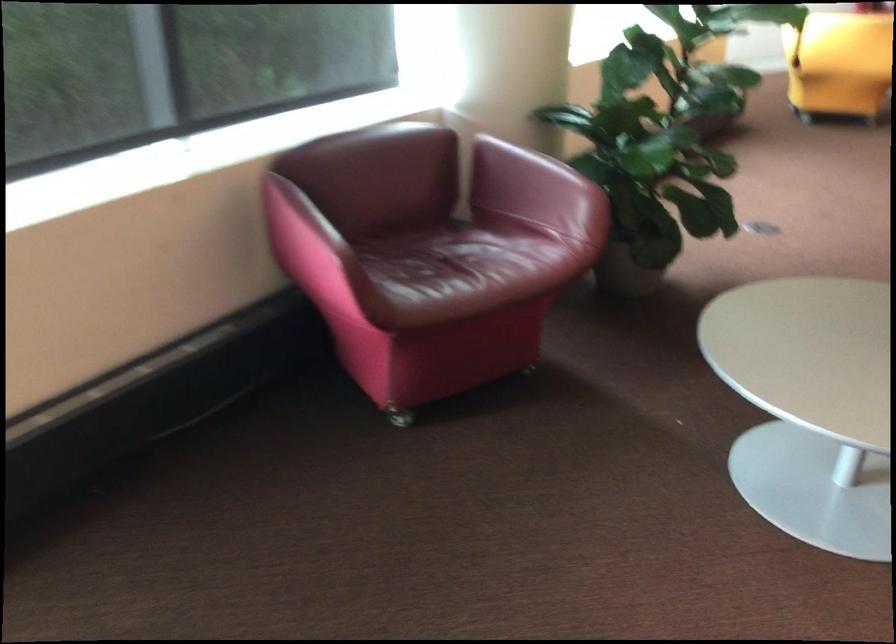
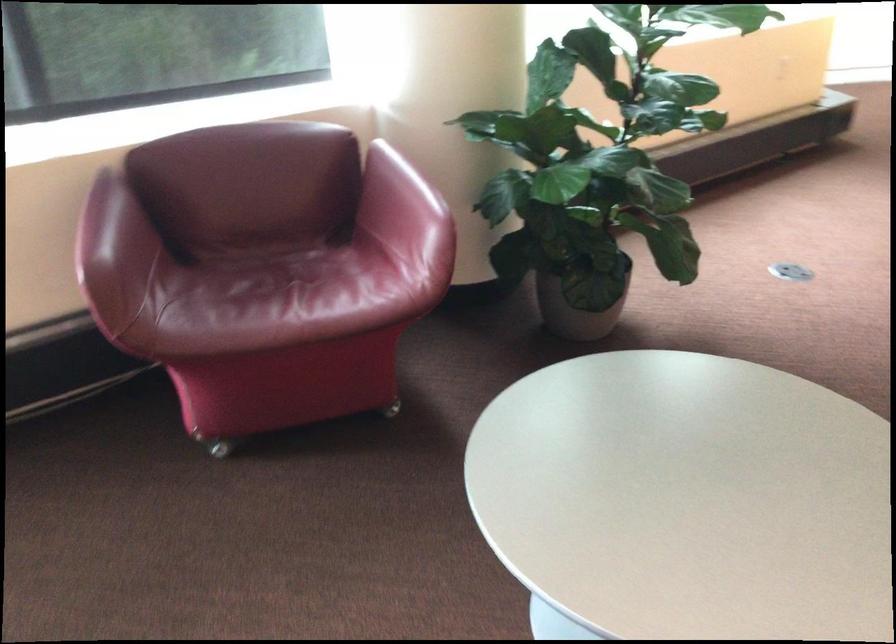
Question: The first image is from the beginning of the video and the second image is from the end. How did the camera likely rotate when shooting the video?

Choices:
 (A) Left
 (B) Right
 (C) Up
 (D) Down

Answer: (A)